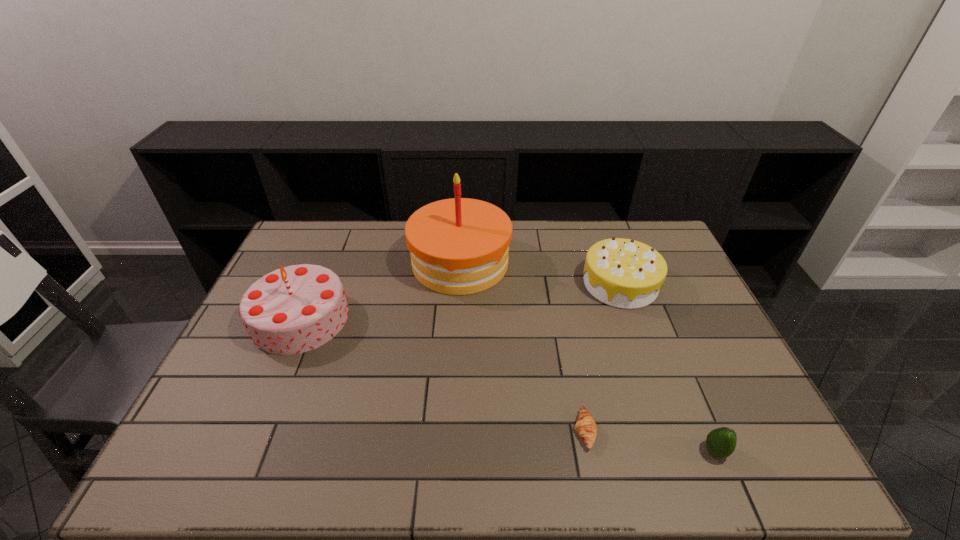
Locate an element on the screen. birthday cake identified as the closest to the fourth tallest object is located at coordinates (623, 273).

Point out which birthday cake is positioned as the second nearest to the leftmost birthday cake. Please provide its 2D coordinates. Your answer should be formatted as a tuple, i.e. [(x, y)], where the tuple contains the x and y coordinates of a point satisfying the conditions above.

[(623, 273)]

Find the location of a particular element. vacant area in the image that satisfies the following two spatial constraints: 1. on the front side of the leftmost object; 2. on the left side of the fourth tallest object is located at coordinates (244, 451).

In order to click on vacant area that satisfies the following two spatial constraints: 1. on the front side of the fourth tallest object; 2. on the right side of the shortest birthday cake in this screenshot , I will do `click(681, 451)`.

You are a GUI agent. You are given a task and a screenshot of the screen. Output one action in this format:
    pyautogui.click(x=<x>, y=<y>)
    Task: Click on the free point that satisfies the following two spatial constraints: 1. on the front side of the second birthday cake from left to right; 2. on the right side of the third shortest object
    This screenshot has width=960, height=540.
    Given the screenshot: What is the action you would take?
    pyautogui.click(x=459, y=284)

At what (x,y) coordinates should I click in order to perform the action: click on free point that satisfies the following two spatial constraints: 1. on the front side of the shortest birthday cake; 2. on the front-facing side of the third object from left to right. Please return your answer as a coordinate pair (x, y). The width and height of the screenshot is (960, 540). Looking at the image, I should click on (673, 431).